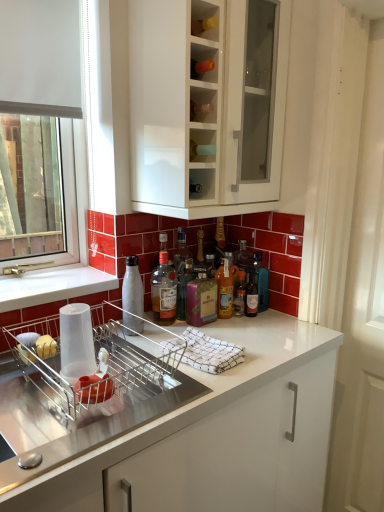
The image size is (384, 512). In order to click on vacant space in front of transparent plastic cup at sink in this screenshot , I will do `click(77, 419)`.